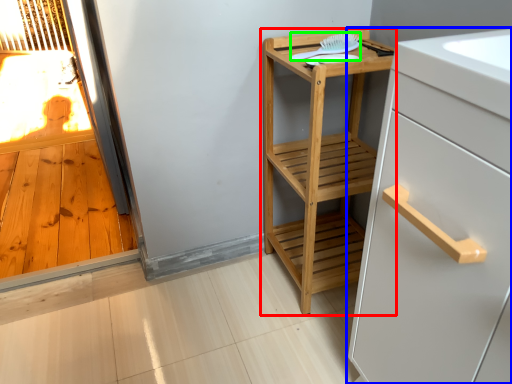
Question: Which object is positioned farthest from furniture (highlighted by a red box)? Select from cabinetry (highlighted by a blue box) and brush (highlighted by a green box).

Choices:
 (A) cabinetry
 (B) brush

Answer: (A)